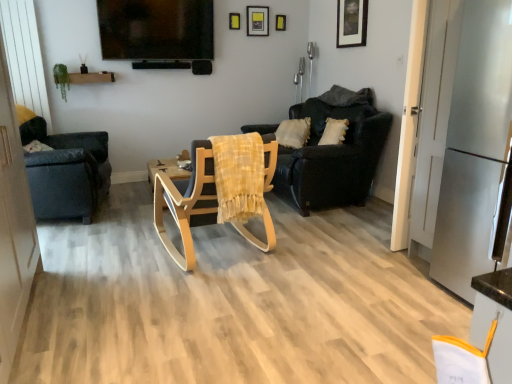
Question: In the image, is matte yellow picture frame at upper center, acting as the 3th picture frame starting from the left, positioned in front of or behind dark brown leather armchair at center, which is the 1th chair in right-to-left order?

Choices:
 (A) behind
 (B) front

Answer: (A)

Question: In the image, is matte yellow picture frame at upper center, the second picture frame when ordered from right to left, on the left side or the right side of dark brown leather armchair at center, which is the 1th chair in right-to-left order?

Choices:
 (A) right
 (B) left

Answer: (B)

Question: Which object is positioned farthest from the yellow matte picture frame at upper center, the 2th picture frame when ordered from front to back?

Choices:
 (A) dark brown leather armchair at center, positioned as the 3th chair in left-to-right order
 (B) wooden rocking chair at center, positioned as the second chair in right-to-left order
 (C) matte black picture frame at upper right, which appears as the fourth picture frame when viewed from the left
 (D) matte yellow picture frame at upper center, the second picture frame when ordered from right to left
 (E) matte black picture frame at upper center, the 2th picture frame in the back-to-front sequence

Answer: (B)

Question: Estimate the real-world distances between objects in this image. Which object is closer to the satin silver refrigerator at right?

Choices:
 (A) matte black picture frame at upper right, which appears as the fourth picture frame when viewed from the left
 (B) yellow matte picture frame at upper center, positioned as the third picture frame in back-to-front order
 (C) matte black picture frame at upper center, arranged as the 3th picture frame when viewed from the right
 (D) matte yellow picture frame at upper center, which is the 1th picture frame in back-to-front order
 (E) wooden rocking chair at center, which appears as the second chair when viewed from the left

Answer: (E)